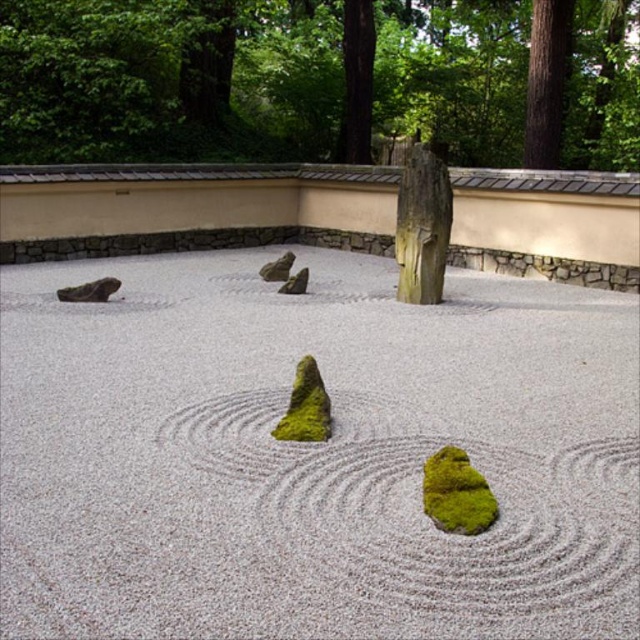
Which is more to the right, green mossy tree stump at center or green mossy stump at center?

Positioned to the right is green mossy tree stump at center.

Measure the distance from green mossy tree stump at center to green mossy stump at center.

green mossy tree stump at center and green mossy stump at center are 36.55 feet apart.

Identify the location of green mossy tree stump at center. 317,80.

Locate an element on the screen. The height and width of the screenshot is (640, 640). green mossy stump at center is located at coordinates (305, 406).

Where is `green mossy stump at center`? The height and width of the screenshot is (640, 640). green mossy stump at center is located at coordinates (305, 406).

The height and width of the screenshot is (640, 640). I want to click on green mossy stump at center, so click(x=305, y=406).

Does white gravel at center appear on the left side of green mossy rock at center?

In fact, white gravel at center is to the right of green mossy rock at center.

Between white gravel at center and green mossy rock at center, which one is positioned lower?

white gravel at center is lower down.

Does point (259, 534) lie in front of point (266, 268)?

Yes, it is in front of point (266, 268).

Locate an element on the screen. The image size is (640, 640). white gravel at center is located at coordinates (310, 452).